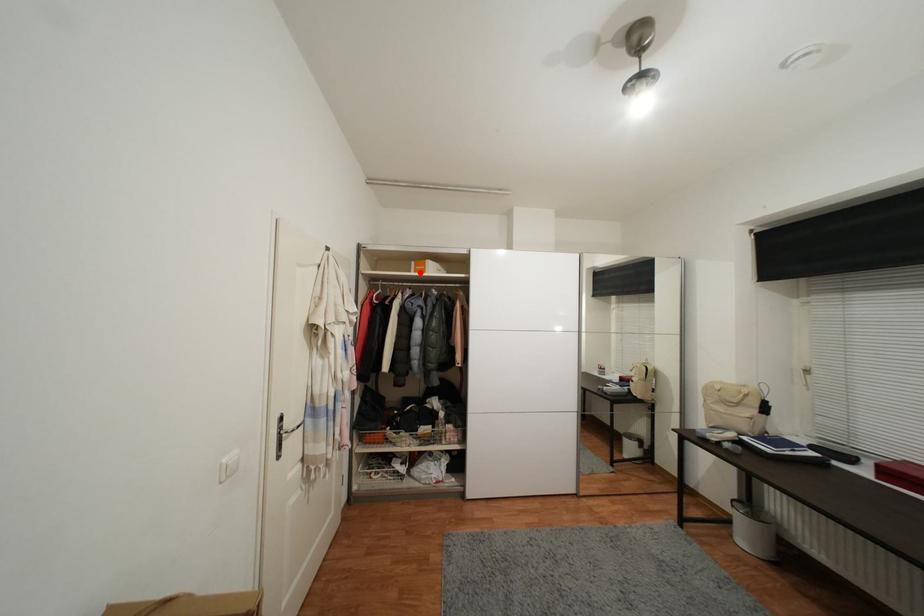
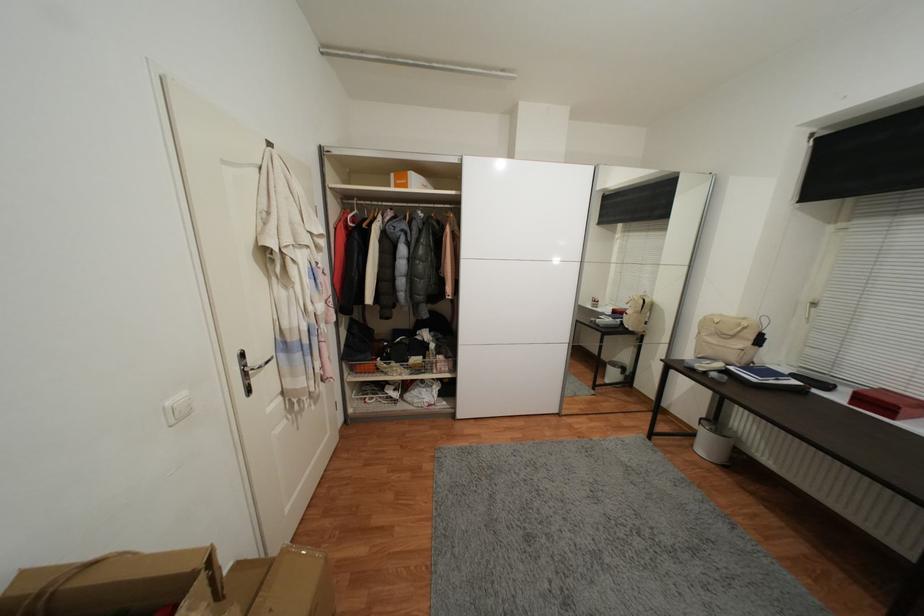
Find the pixel in the second image that matches the highlighted location in the first image.

(400, 188)